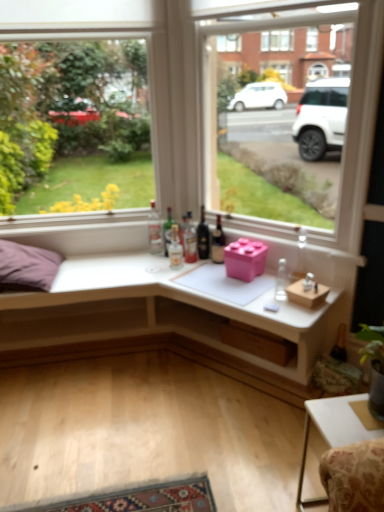
At what (x,y) coordinates should I click in order to perform the action: click on free region on the left part of dark glass bottle at center, the 2th bottle positioned from the right. Please return your answer as a coordinate pair (x, y). Looking at the image, I should click on (194, 267).